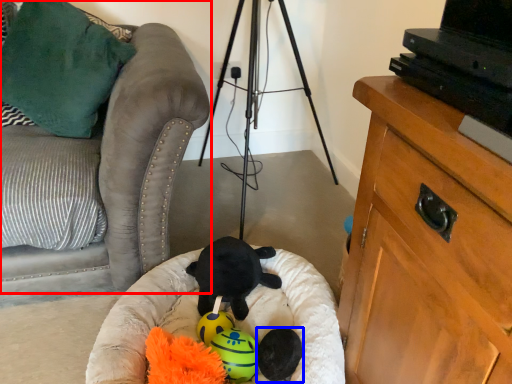
Question: Which of the following is the closest to the observer, furniture (highlighted by a red box) or toy (highlighted by a blue box)?

Choices:
 (A) furniture
 (B) toy

Answer: (A)